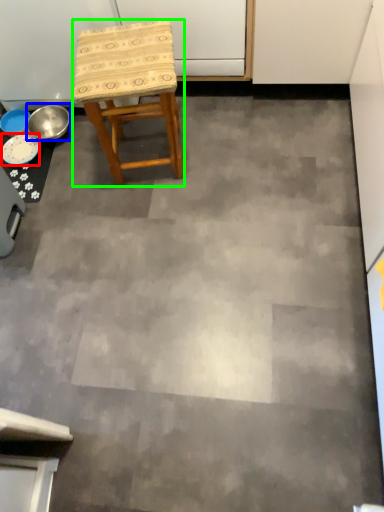
Question: Which is nearer to the plate (highlighted by a red box)? bowl (highlighted by a blue box) or stool (highlighted by a green box).

Choices:
 (A) bowl
 (B) stool

Answer: (A)